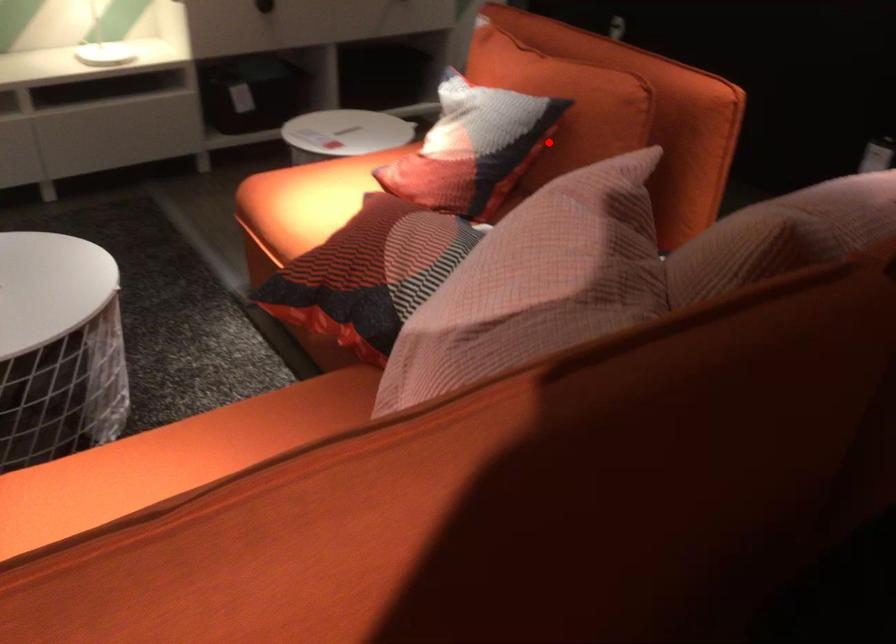
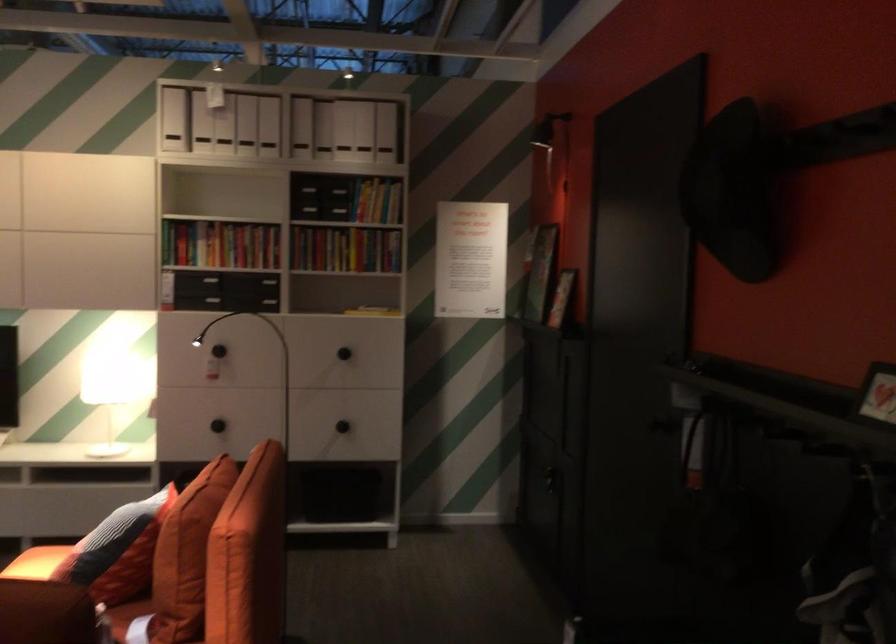
The point at the highlighted location is marked in the first image. Where is the corresponding point in the second image?

(117, 551)